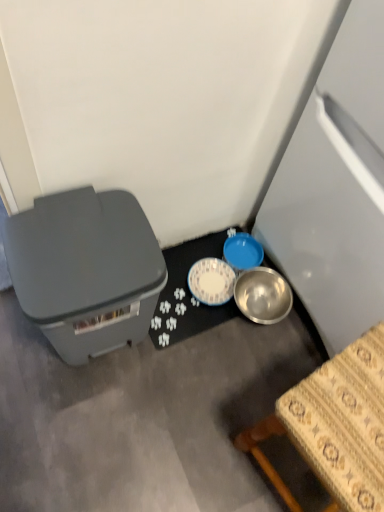
Locate an element on the screen. The height and width of the screenshot is (512, 384). vacant point above metallic silver bowl at lower center (from a real-world perspective) is located at coordinates (209, 280).